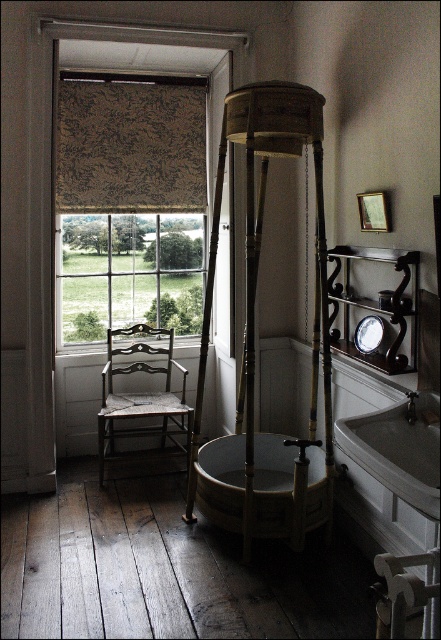
Who is positioned more to the right, brown textured curtain at upper left or white porcelain sink at lower right?

Positioned to the right is white porcelain sink at lower right.

Does brown textured curtain at upper left appear on the right side of white porcelain sink at lower right?

In fact, brown textured curtain at upper left is to the left of white porcelain sink at lower right.

Which is behind, point (164, 132) or point (384, 458)?

The point (164, 132) is behind.

Locate an element on the screen. The height and width of the screenshot is (640, 441). brown textured curtain at upper left is located at coordinates (130, 144).

Is the position of textured beige fabric at upper left less distant than that of wooden chair at left?

Yes, it is in front of wooden chair at left.

What do you see at coordinates (134, 182) in the screenshot?
I see `textured beige fabric at upper left` at bounding box center [134, 182].

Identify the location of textured beige fabric at upper left. This screenshot has width=441, height=640. (134, 182).

Which of these two, textured beige fabric at upper left or brown textured curtain at upper left, stands shorter?

Standing shorter between the two is brown textured curtain at upper left.

Is textured beige fabric at upper left to the left of brown textured curtain at upper left from the viewer's perspective?

Indeed, textured beige fabric at upper left is positioned on the left side of brown textured curtain at upper left.

This screenshot has height=640, width=441. Identify the location of textured beige fabric at upper left. (134, 182).

In order to click on textured beige fabric at upper left in this screenshot , I will do `click(134, 182)`.